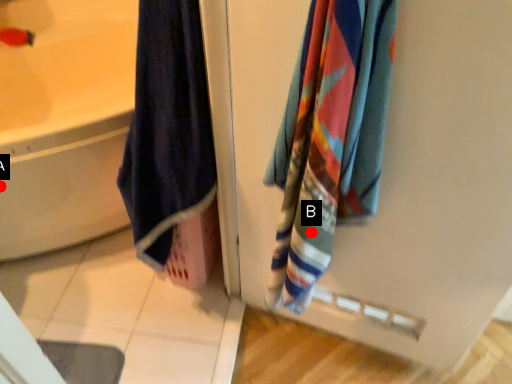
Question: Two points are circled on the image, labeled by A and B beside each circle. Which point appears farthest from the camera in this image?

Choices:
 (A) A is further
 (B) B is further

Answer: (A)